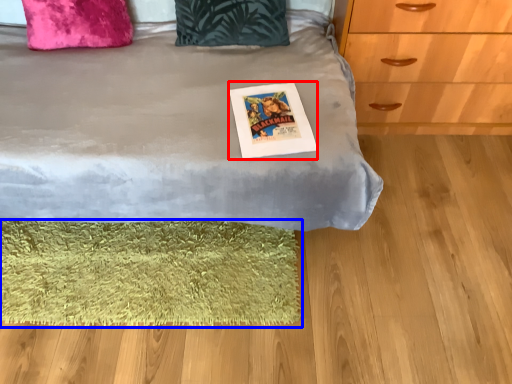
Question: Which point is further to the camera, postcard (highlighted by a red box) or mat (highlighted by a blue box)?

Choices:
 (A) postcard
 (B) mat

Answer: (B)